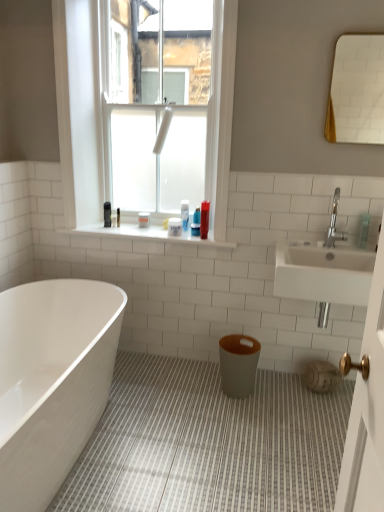
The height and width of the screenshot is (512, 384). I want to click on free space above matte gray toilet bowl at center (from a real-world perspective), so click(x=240, y=343).